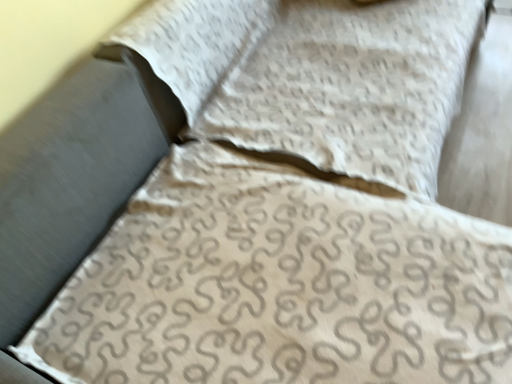
Where is `beige fabric pillow at center`? This screenshot has width=512, height=384. beige fabric pillow at center is located at coordinates pyautogui.click(x=351, y=87).

What do you see at coordinates (351, 87) in the screenshot? I see `beige fabric pillow at center` at bounding box center [351, 87].

Image resolution: width=512 pixels, height=384 pixels. In order to click on beige fabric pillow at center in this screenshot , I will do `click(351, 87)`.